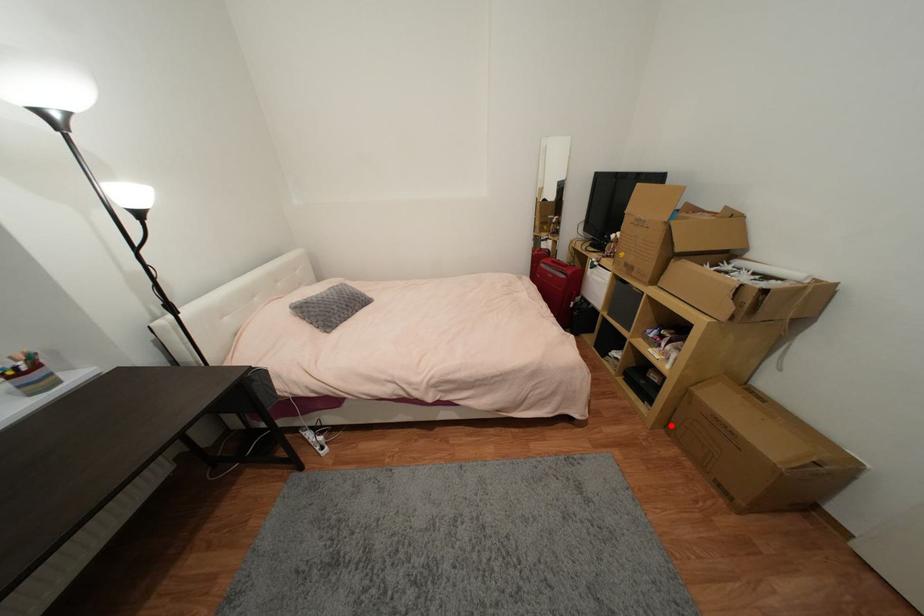
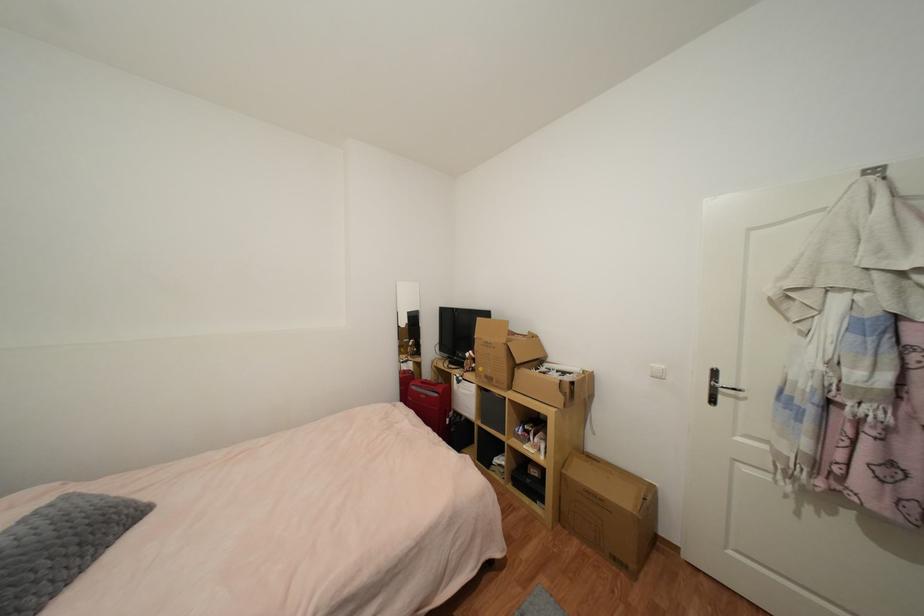
Question: I am providing you with two images of the same scene from different viewpoints. A red point is shown in image1. For the corresponding object point in image2, is it positioned nearer or farther from the camera?

Choices:
 (A) Nearer
 (B) Farther

Answer: (B)